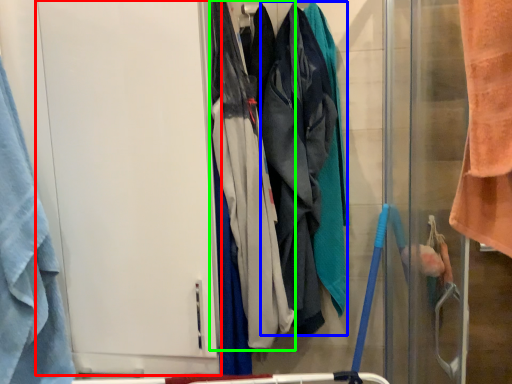
Question: Estimate the real-world distances between objects in this image. Which object is closer to screen door (highlighted by a red box), wide (highlighted by a blue box) or wide (highlighted by a green box)?

Choices:
 (A) wide
 (B) wide

Answer: (B)